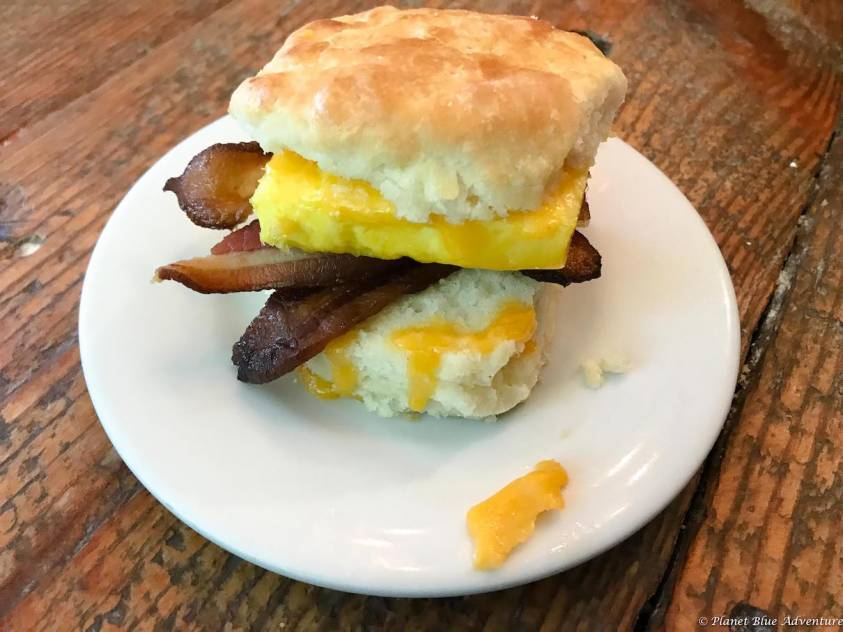
Locate an element on the screen. plate is located at coordinates (685, 385).